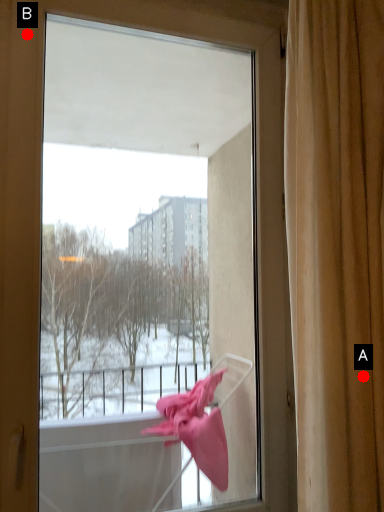
Question: Two points are circled on the image, labeled by A and B beside each circle. Which point is farther to the camera?

Choices:
 (A) A is further
 (B) B is further

Answer: (B)